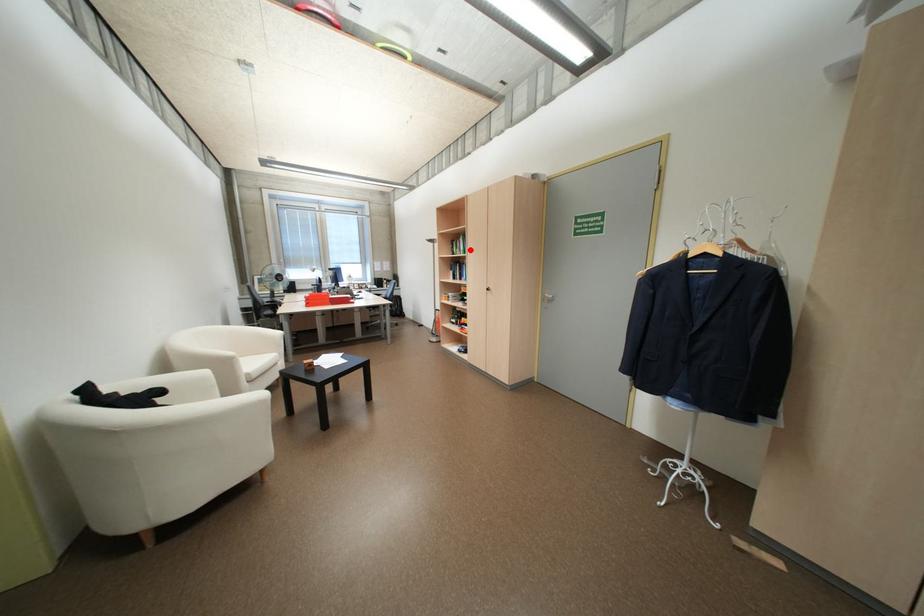
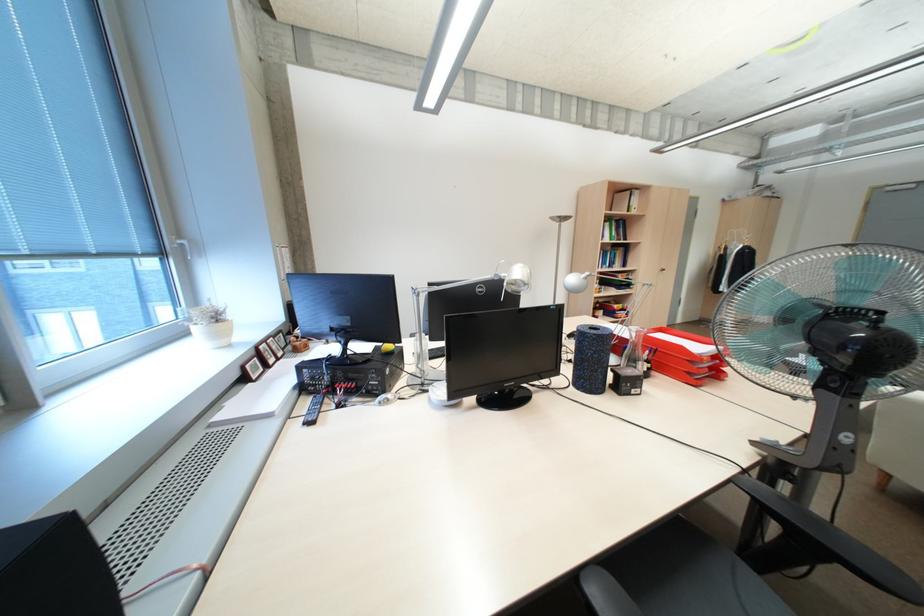
Find the pixel in the second image that matches the highlighted location in the first image.

(612, 236)